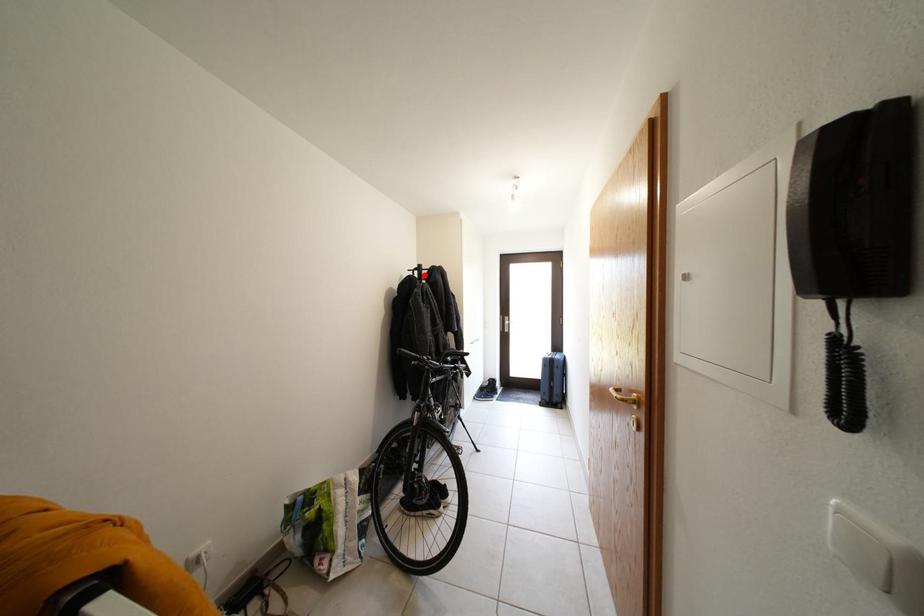
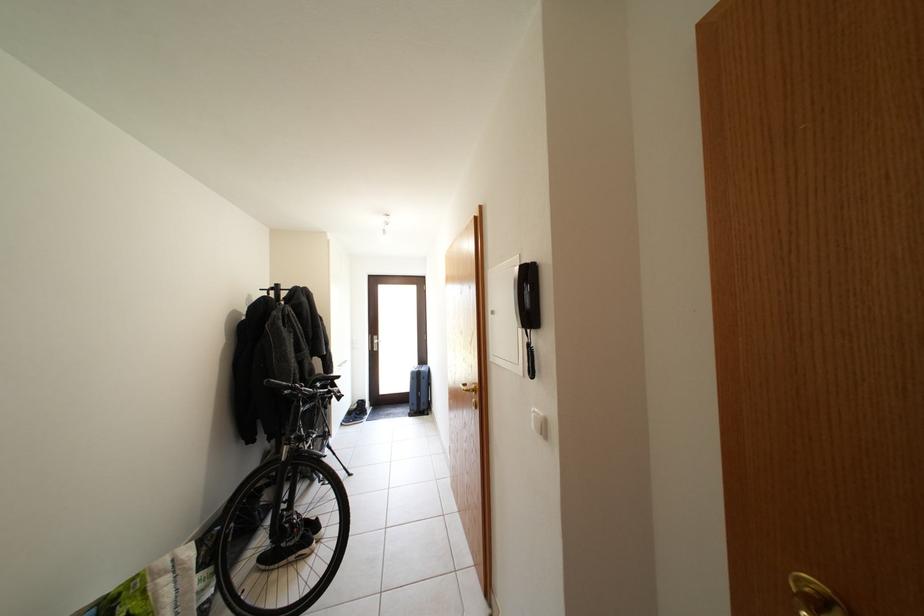
Where in the second image is the point corresponding to the highlighted location from the first image?

(281, 294)